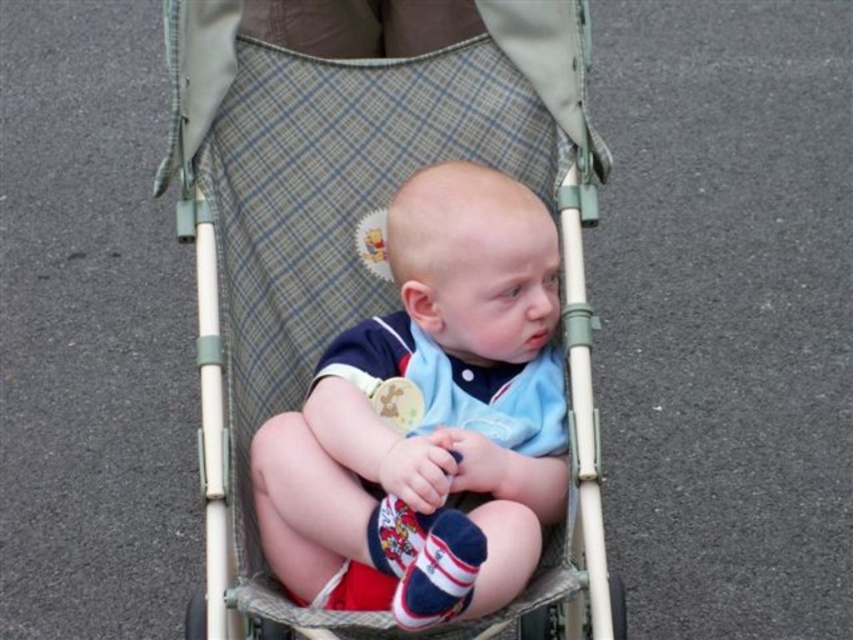
Question: Among these points, which one is nearest to the camera?

Choices:
 (A) (514, 589)
 (B) (373, 304)

Answer: (A)

Question: Is plaid fabric baby carriage at center smaller than light blue cotton shirt at center?

Choices:
 (A) no
 (B) yes

Answer: (A)

Question: Is plaid fabric baby carriage at center to the right of light blue cotton shirt at center from the viewer's perspective?

Choices:
 (A) yes
 (B) no

Answer: (B)

Question: Which point is farther to the camera?

Choices:
 (A) light blue cotton shirt at center
 (B) plaid fabric baby carriage at center

Answer: (B)

Question: Can you confirm if plaid fabric baby carriage at center is positioned to the left of light blue cotton shirt at center?

Choices:
 (A) yes
 (B) no

Answer: (A)

Question: Which of the following is the farthest from the observer?

Choices:
 (A) (495, 307)
 (B) (239, 449)

Answer: (B)